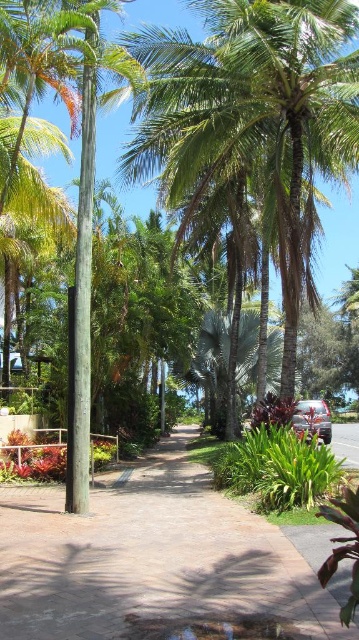
Between green leafy palm tree at center and green matte pole at center, which one has less height?

Standing shorter between the two is green matte pole at center.

Describe the element at coordinates (253, 118) in the screenshot. I see `green leafy palm tree at center` at that location.

The image size is (359, 640). Identify the location of green leafy palm tree at center. (253, 118).

Which is more to the right, brown concrete pavement at center or green matte pole at center?

Positioned to the right is brown concrete pavement at center.

In the scene shown: Can you confirm if brown concrete pavement at center is shorter than green matte pole at center?

No, brown concrete pavement at center is not shorter than green matte pole at center.

Does point (246, 634) come in front of point (78, 337)?

Yes, point (246, 634) is closer to viewer.

This screenshot has height=640, width=359. I want to click on brown concrete pavement at center, so click(x=157, y=560).

You are a GUI agent. You are given a task and a screenshot of the screen. Output one action in this format:
    pyautogui.click(x=<x>, y=<y>)
    Task: Click on the green matte pole at center
    Image resolution: width=359 pixels, height=640 pixels.
    Given the screenshot: What is the action you would take?
    pyautogui.click(x=81, y=314)